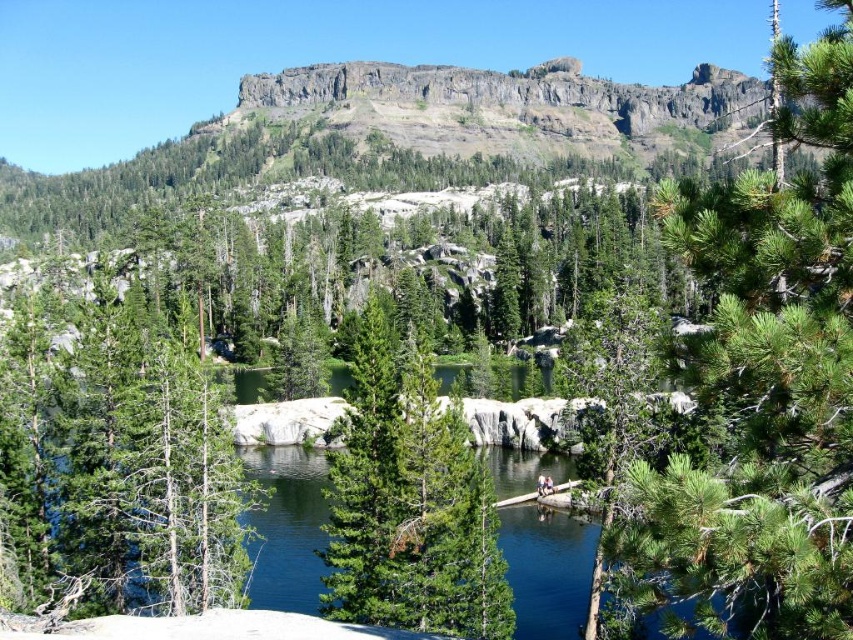
Question: Estimate the real-world distances between objects in this image. Which object is farther from the green needle-like tree at center?

Choices:
 (A) clear blue water at center
 (B) green needle-like tree at center-right
 (C) green matte tree at center

Answer: (B)

Question: Where is green needle-like tree at center-right located in relation to green matte tree at center in the image?

Choices:
 (A) below
 (B) above

Answer: (B)

Question: Is green needle-like tree at center to the left of green matte tree at center from the viewer's perspective?

Choices:
 (A) yes
 (B) no

Answer: (A)

Question: Which point is farther from the camera taking this photo?

Choices:
 (A) (352, 368)
 (B) (630, 413)
 (C) (242, 456)
 (D) (741, 182)

Answer: (C)

Question: Which of the following is the closest to the observer?

Choices:
 (A) green matte tree at center
 (B) green needle-like tree at center-right
 (C) green needle-like tree at center
 (D) clear blue water at center

Answer: (B)

Question: Considering the relative positions of green needle-like tree at center and green matte tree at center in the image provided, where is green needle-like tree at center located with respect to green matte tree at center?

Choices:
 (A) left
 (B) right

Answer: (A)